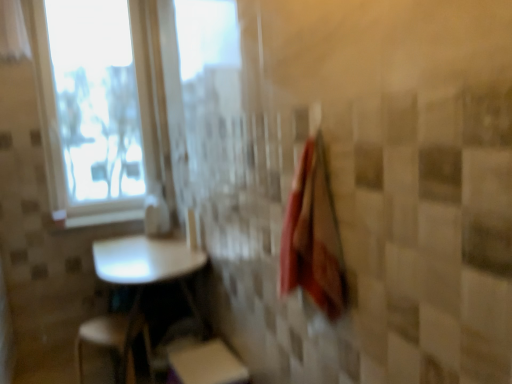
Question: Can you confirm if white sheer curtain at upper left is smaller than white glossy table at lower left?

Choices:
 (A) no
 (B) yes

Answer: (B)

Question: Is white sheer curtain at upper left in contact with white glossy table at lower left?

Choices:
 (A) yes
 (B) no

Answer: (B)

Question: Does white sheer curtain at upper left have a lesser width compared to white glossy table at lower left?

Choices:
 (A) yes
 (B) no

Answer: (A)

Question: Can you confirm if white sheer curtain at upper left is wider than white glossy table at lower left?

Choices:
 (A) yes
 (B) no

Answer: (B)

Question: From the image's perspective, does white sheer curtain at upper left appear lower than white glossy table at lower left?

Choices:
 (A) yes
 (B) no

Answer: (B)

Question: Based on their sizes in the image, would you say white sheer curtain at upper left is bigger or smaller than white glossy window sill at upper left?

Choices:
 (A) big
 (B) small

Answer: (A)

Question: Based on their positions, is white sheer curtain at upper left located to the left or right of white glossy window sill at upper left?

Choices:
 (A) right
 (B) left

Answer: (B)

Question: Is white sheer curtain at upper left in front of or behind white glossy window sill at upper left in the image?

Choices:
 (A) front
 (B) behind

Answer: (A)

Question: Would you say white sheer curtain at upper left is inside or outside white glossy window sill at upper left?

Choices:
 (A) outside
 (B) inside

Answer: (A)

Question: Is white glossy table at lower left spatially inside white glossy window sill at upper left, or outside of it?

Choices:
 (A) outside
 (B) inside

Answer: (A)

Question: Considering the positions of white glossy table at lower left and white glossy window sill at upper left in the image, is white glossy table at lower left wider or thinner than white glossy window sill at upper left?

Choices:
 (A) thin
 (B) wide

Answer: (B)

Question: In terms of height, does white glossy table at lower left look taller or shorter compared to white glossy window sill at upper left?

Choices:
 (A) tall
 (B) short

Answer: (A)

Question: In terms of size, does white glossy table at lower left appear bigger or smaller than white glossy window sill at upper left?

Choices:
 (A) small
 (B) big

Answer: (B)

Question: In terms of width, does white plastic step stool at lower left, which is the 2th step stool in right-to-left order, look wider or thinner when compared to red cotton bath towel at right?

Choices:
 (A) wide
 (B) thin

Answer: (A)

Question: Would you say white plastic step stool at lower left, which is the 2th step stool in right-to-left order, is inside or outside red cotton bath towel at right?

Choices:
 (A) outside
 (B) inside

Answer: (A)